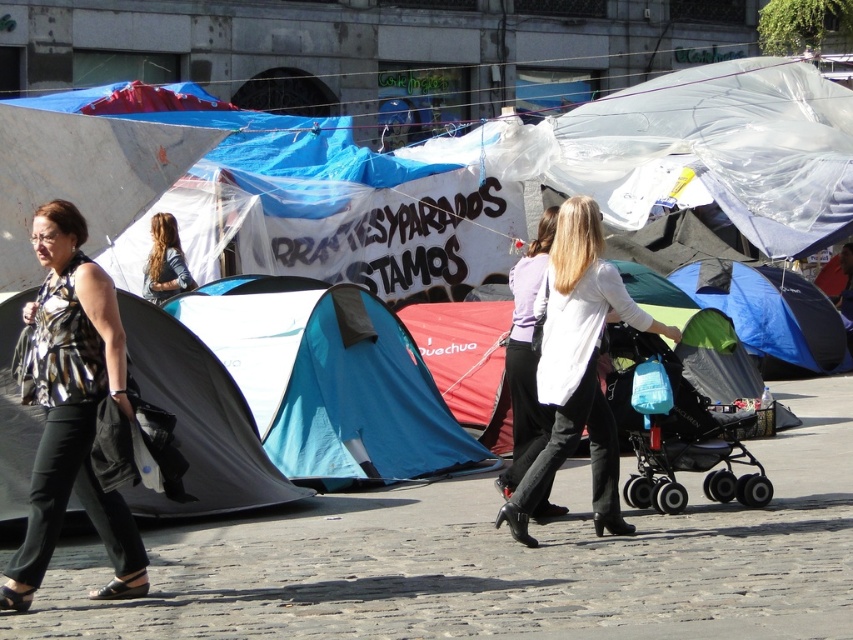
You are standing in the plaza looking at the tents. There are two points marked in the image. The first point is at coordinates point (323,422) and the second point is at point (47,321). Which point is closer to you?

Point (47,321) is closer to you because it is less further to the camera than point (323,422).